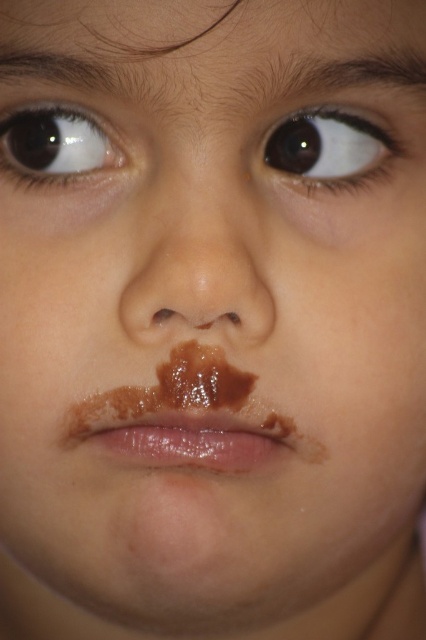
Between shiny brown lips at center and brown glossy eye at upper left, which one has more height?

With more height is brown glossy eye at upper left.

Find the location of a particular element. shiny brown lips at center is located at coordinates (189, 442).

Can you confirm if shiny brown nose at center is wider than brown glossy eye at upper center?

Yes.

Image resolution: width=426 pixels, height=640 pixels. Identify the location of shiny brown nose at center. (193, 268).

Describe the element at coordinates (193, 268) in the screenshot. I see `shiny brown nose at center` at that location.

The image size is (426, 640). In order to click on shiny brown nose at center in this screenshot , I will do click(193, 268).

Can you confirm if shiny brown lips at center is smaller than brown glossy eye at upper center?

Incorrect, shiny brown lips at center is not smaller in size than brown glossy eye at upper center.

Between shiny brown lips at center and brown glossy eye at upper center, which one has less height?

shiny brown lips at center

Does point (143, 456) come in front of point (354, 132)?

That is True.

Identify the location of shiny brown lips at center. This screenshot has height=640, width=426. (189, 442).